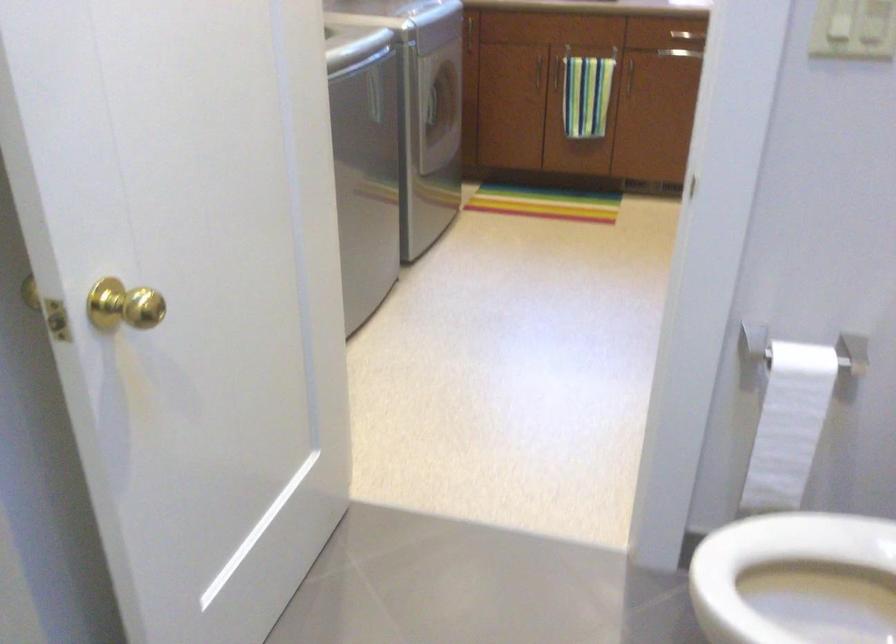
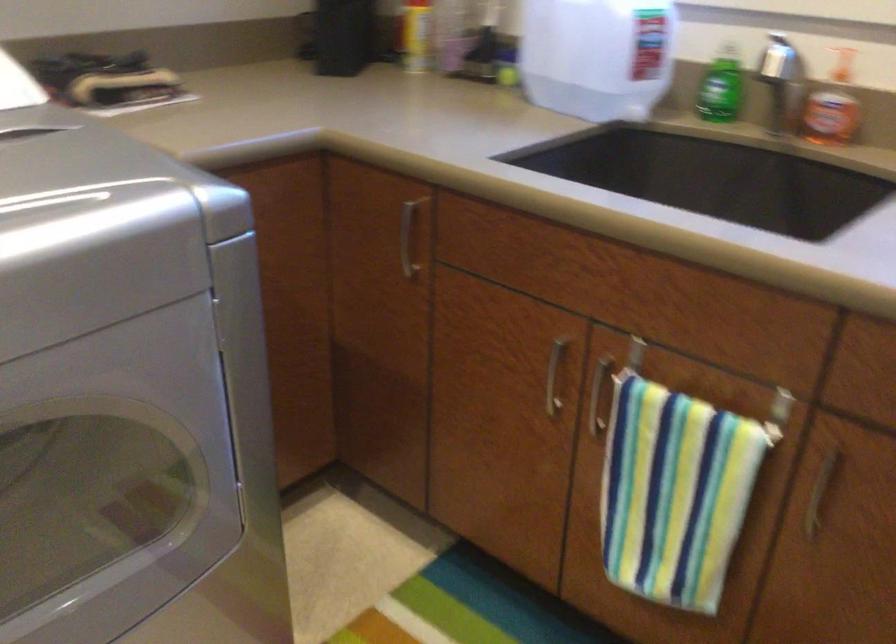
Locate, in the second image, the point that corresponds to (x=626, y=77) in the first image.

(819, 494)